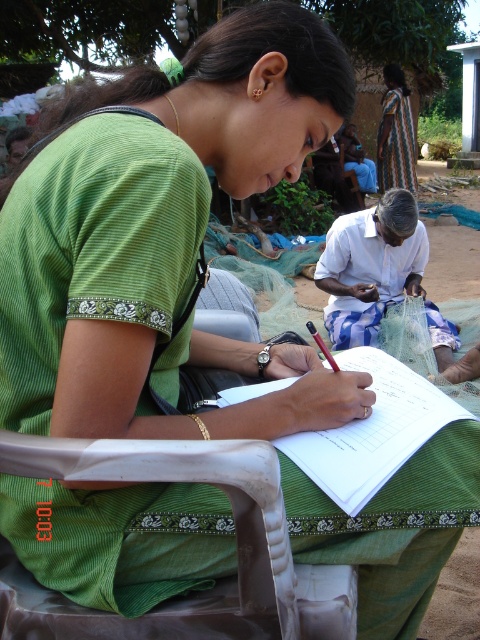
You are a photographer trying to capture both the white paper at center and the striped fabric dress at upper right in the same frame. Which object should you focus on first to ensure both are in the frame?

The white paper at center is shorter than the striped fabric dress at upper right, so you should focus on the striped fabric dress at upper right first to ensure both are in the frame.

You are an artist trying to sketch the scene. You need to decide which object to draw first based on their thickness. According to the scene, which object is thinner, the white paper at center or the striped fabric dress at upper right?

The white paper at center is thinner than the striped fabric dress at upper right, so you should draw the white paper at center first since it is thinner.